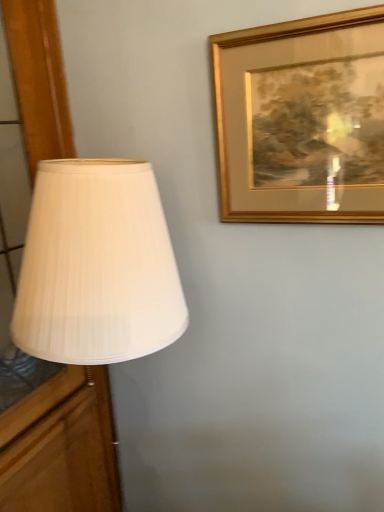
Question: Should I look upward or downward to see gold/golden frame at upper right?

Choices:
 (A) down
 (B) up

Answer: (B)